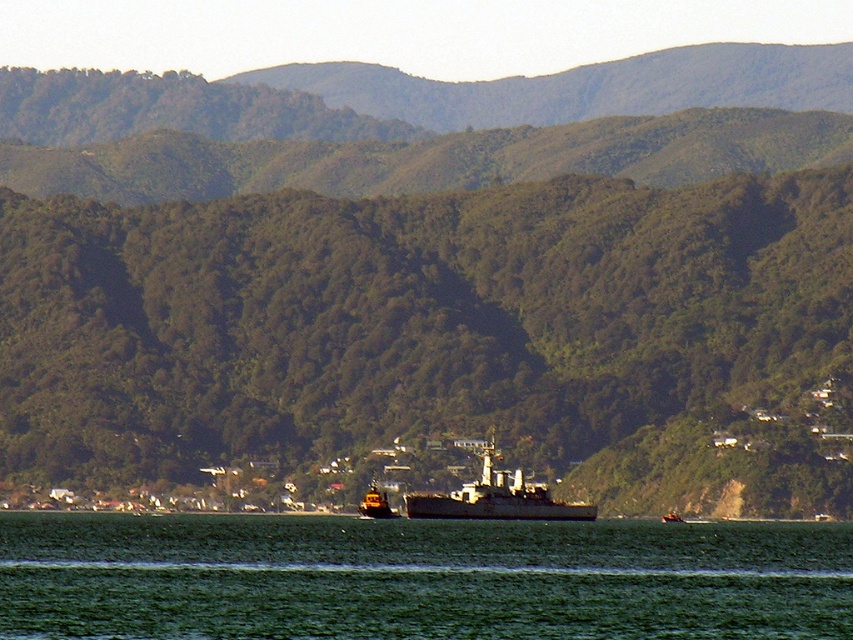
Can you confirm if green water at lower center is bigger than gray metallic ship at center?

Correct, green water at lower center is larger in size than gray metallic ship at center.

Is point (225, 538) farther from viewer compared to point (454, 497)?

Yes, point (225, 538) is farther from viewer.

Locate an element on the screen. This screenshot has width=853, height=640. green water at lower center is located at coordinates (418, 579).

Who is more distant from viewer, (744, 529) or (384, 496)?

Point (744, 529)

Between green water at lower center and yellow rubber boat at center, which one appears on the left side from the viewer's perspective?

From the viewer's perspective, yellow rubber boat at center appears more on the left side.

Which is in front, point (624, 582) or point (369, 513)?

Point (369, 513) is more forward.

The image size is (853, 640). I want to click on green water at lower center, so click(418, 579).

Who is higher up, gray metallic ship at center or yellow rubber boat at center?

gray metallic ship at center is higher up.

What do you see at coordinates (496, 497) in the screenshot? I see `gray metallic ship at center` at bounding box center [496, 497].

In the scene shown: Who is more distant from viewer, (486, 481) or (370, 484)?

Point (370, 484)

Where is `gray metallic ship at center`? The image size is (853, 640). gray metallic ship at center is located at coordinates (496, 497).